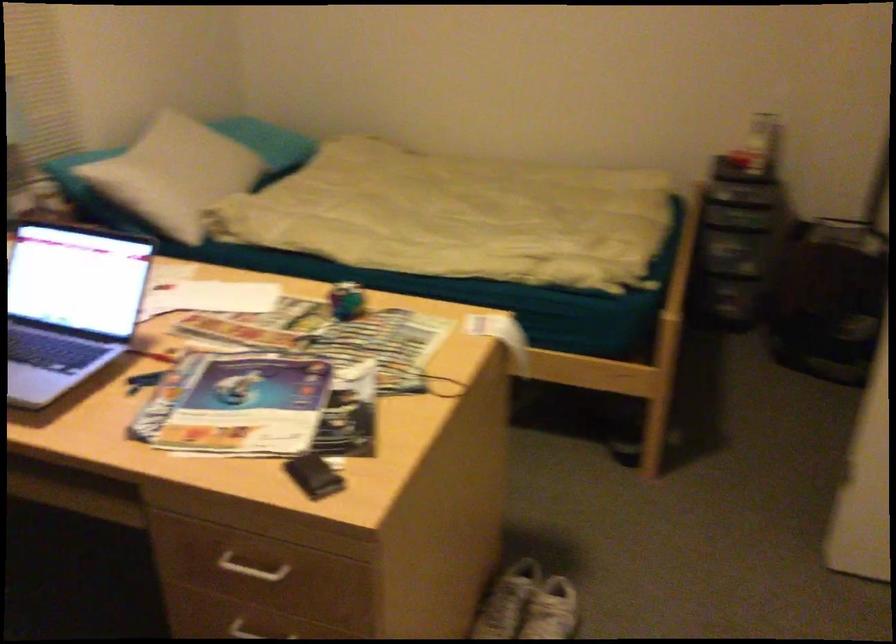
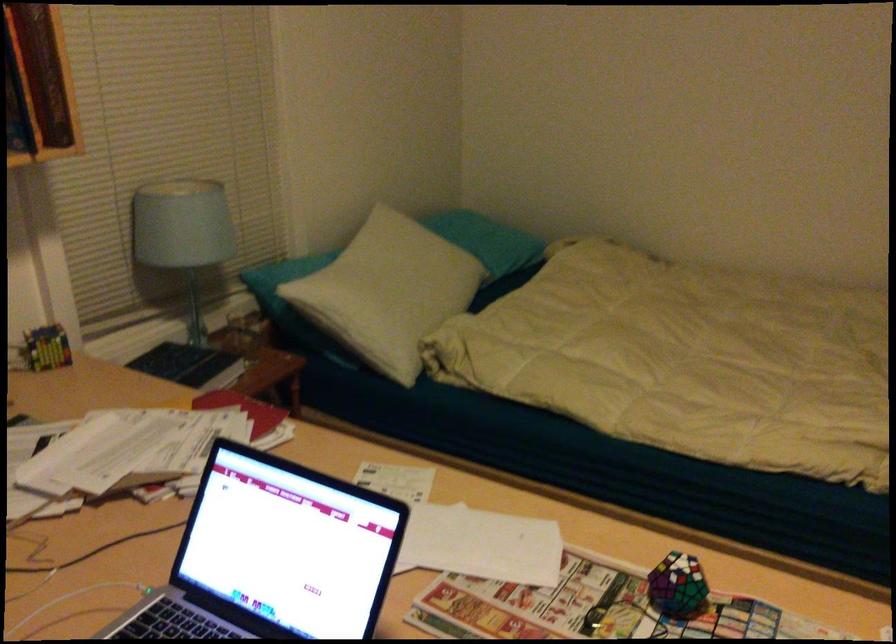
In the second image, find the point that corresponds to point (349, 298) in the first image.

(677, 585)